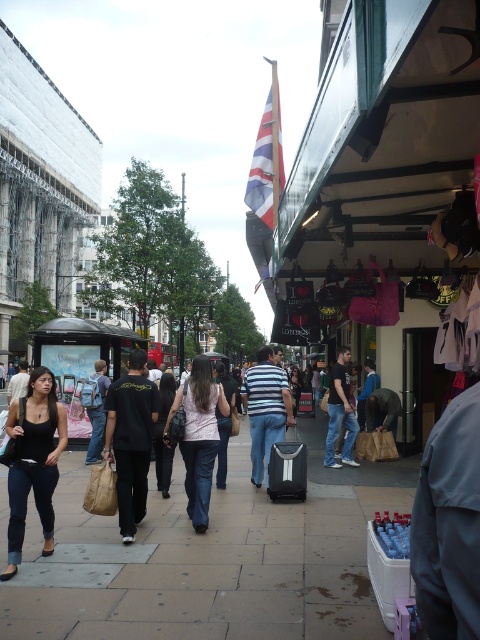
Question: Which point is farther to the camera?

Choices:
 (A) (343, 396)
 (B) (288, 461)
 (C) (27, 449)

Answer: (A)

Question: Where is smooth concrete sidewalk at center located in relation to black fabric suitcase at center in the image?

Choices:
 (A) above
 (B) below

Answer: (B)

Question: Is striped cotton shirt at center further to the viewer compared to black backpack at center?

Choices:
 (A) no
 (B) yes

Answer: (A)

Question: Can you confirm if black fabric suitcase at center is smaller than denim pants at center?

Choices:
 (A) no
 (B) yes

Answer: (B)

Question: Which point is closer to the camera?

Choices:
 (A) (113, 397)
 (B) (227, 410)
 (C) (61, 422)
 (D) (252, 397)

Answer: (C)

Question: Which object is closer to the camera taking this photo?

Choices:
 (A) striped cotton shirt at center
 (B) denim pants at center
 (C) smooth concrete sidewalk at center

Answer: (C)